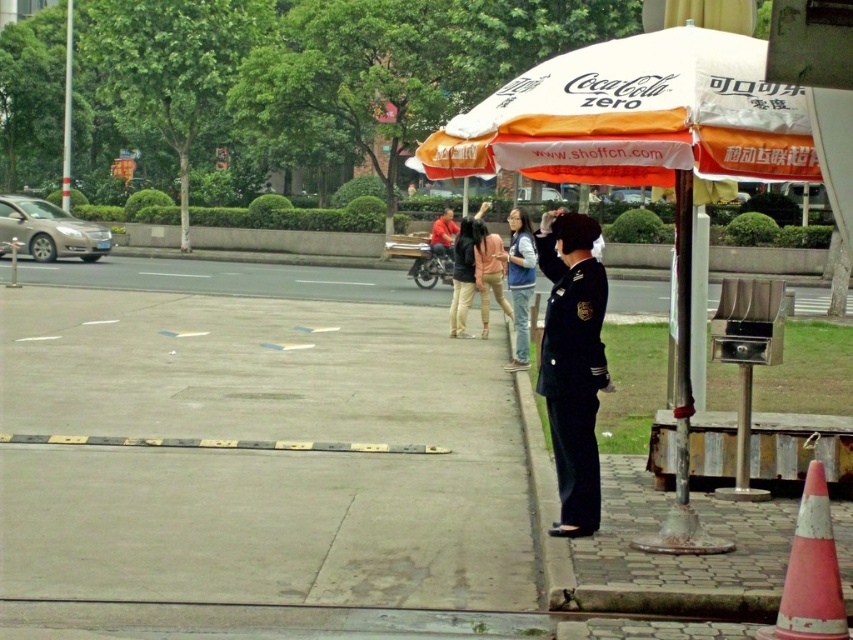
Question: Can you confirm if gray concrete pavement at lower left is bigger than black uniform at right?

Choices:
 (A) yes
 (B) no

Answer: (A)

Question: Is white fabric umbrella at upper center to the left of metallic pole at right from the viewer's perspective?

Choices:
 (A) no
 (B) yes

Answer: (B)

Question: Which object is the farthest from the black uniform at right?

Choices:
 (A) brushed metal pole at left
 (B) white fabric umbrella at center

Answer: (A)

Question: Which object is the closest to the white fabric umbrella at center?

Choices:
 (A) matte red jacket at center
 (B) light pink fabric pants at center
 (C) black uniform at right

Answer: (C)

Question: Does orange reflective cone at lower right lie in front of matte red jacket at center?

Choices:
 (A) no
 (B) yes

Answer: (B)

Question: Among these points, which one is farthest from the camera?

Choices:
 (A) (688, 278)
 (B) (674, 141)
 (C) (599, 113)
 (D) (801, 515)

Answer: (A)